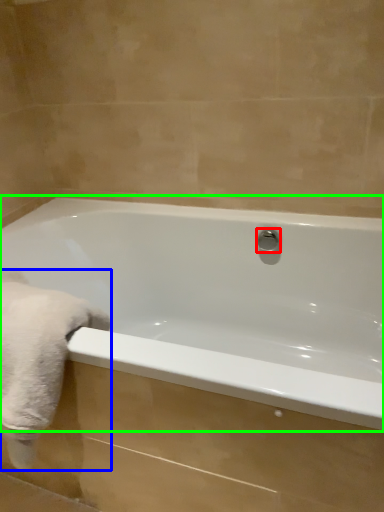
Question: Considering the real-world distances, which object is closest to shower (highlighted by a red box)? bath towel (highlighted by a blue box) or bathtub (highlighted by a green box).

Choices:
 (A) bath towel
 (B) bathtub

Answer: (B)